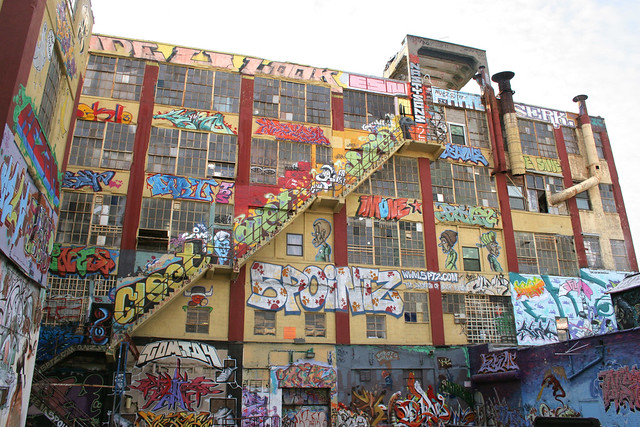
Find the location of a particular element. 1 long set of stairs is located at coordinates (372, 171).